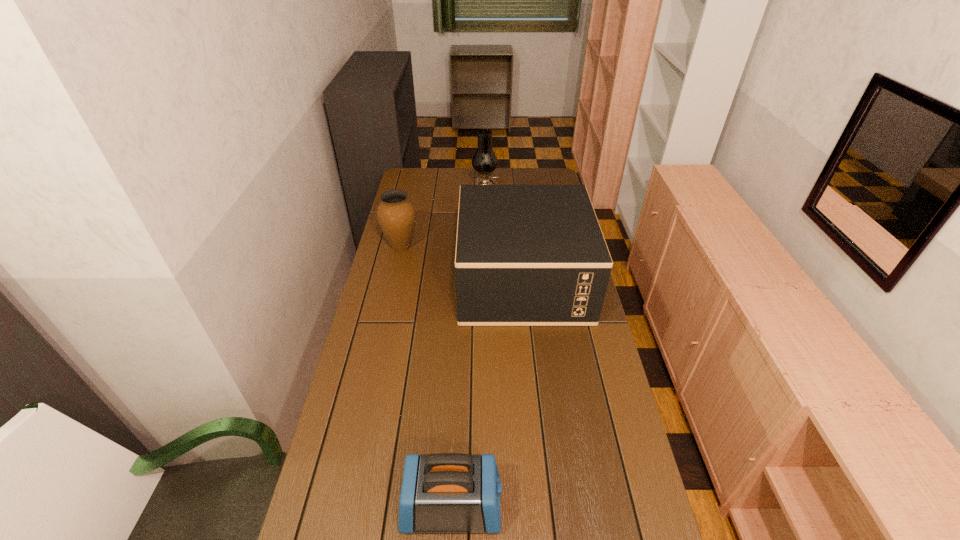
Where is `the farthest object`? Image resolution: width=960 pixels, height=540 pixels. the farthest object is located at coordinates (484, 161).

This screenshot has height=540, width=960. What are the coordinates of `box` in the screenshot? It's located at (526, 255).

This screenshot has width=960, height=540. I want to click on the leftmost object, so click(x=396, y=215).

Find the location of `toaster`. toaster is located at coordinates (446, 492).

Identify the location of the nearest object. (446, 492).

At what (x,y) coordinates should I click in order to perform the action: click on vacant space located on the left of the farthest object. Please return your answer as a coordinate pair (x, y). Looking at the image, I should click on (419, 194).

I want to click on vacant region located 0.320m on the front-facing side of the box, so [373, 280].

Identify the location of vacant region located on the front-facing side of the box. pyautogui.click(x=409, y=280).

At what (x,y) coordinates should I click in order to perform the action: click on free space located 0.290m on the front-facing side of the box. Please return your answer as a coordinate pair (x, y). This screenshot has width=960, height=540. Looking at the image, I should click on (382, 280).

The height and width of the screenshot is (540, 960). I want to click on free space located 0.280m on the right of the leftmost object, so pyautogui.click(x=489, y=247).